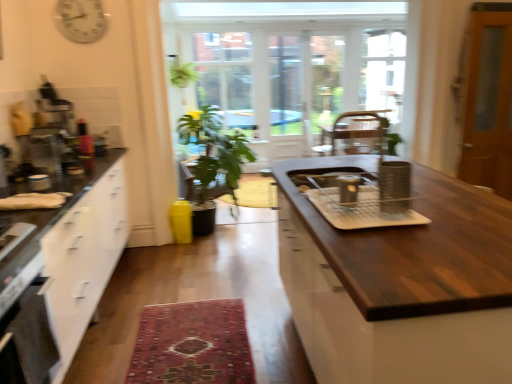
This screenshot has height=384, width=512. I want to click on free space behind carpeted rug at center, so click(197, 278).